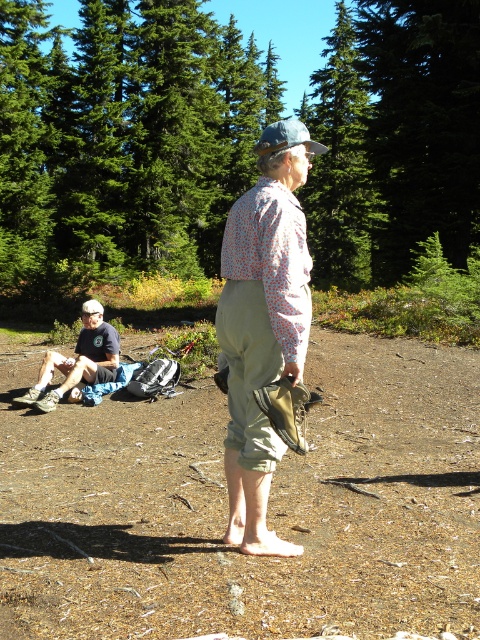
Is point (450, 3) positioned before point (74, 392)?

No.

Is point (412, 122) behind point (86, 333)?

Yes.

The height and width of the screenshot is (640, 480). In order to click on green leafy tree at upper center in this screenshot , I will do `click(421, 125)`.

Who is more distant from viewer, (245, 458) or (90, 365)?

Positioned behind is point (90, 365).

Image resolution: width=480 pixels, height=640 pixels. Find the location of `khakimaterial/texturepants at center`. khakimaterial/texturepants at center is located at coordinates point(264,323).

Between green leafy tree at upper center and green textured tree at upper center, which one has less height?

green leafy tree at upper center is shorter.

Does point (409, 42) come behind point (370, 196)?

No, (409, 42) is in front of (370, 196).

Locate an element on the screen. green leafy tree at upper center is located at coordinates (421, 125).